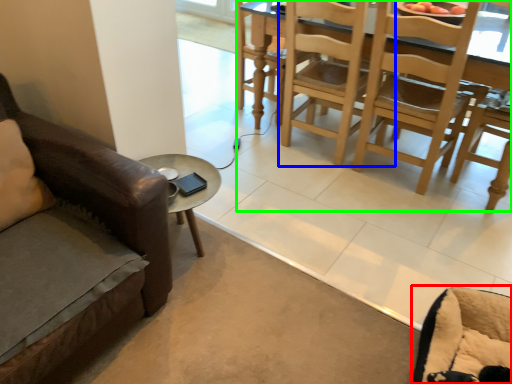
Question: Based on their relative distances, which object is nearer to swivel chair (highlighted by a red box)? Choose from chair (highlighted by a blue box) and kitchen & dining room table (highlighted by a green box).

Choices:
 (A) chair
 (B) kitchen & dining room table

Answer: (B)